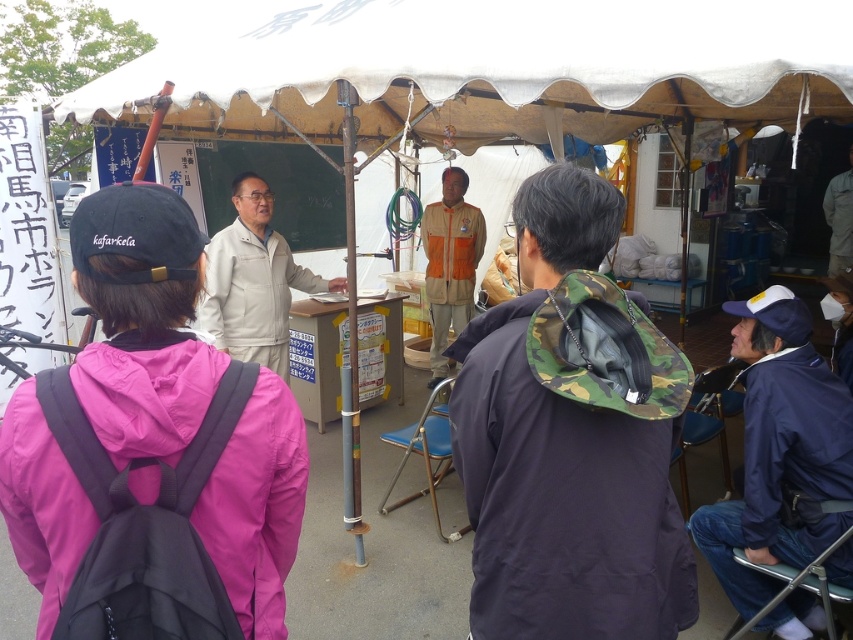
Is white fabric canopy at upper center thinner than camo jacket at center?

No.

Is white fabric canopy at upper center wider than camo jacket at center?

Yes, white fabric canopy at upper center is wider than camo jacket at center.

Where is `white fabric canopy at upper center`? white fabric canopy at upper center is located at coordinates (497, 67).

Where is `white fabric canopy at upper center`? white fabric canopy at upper center is located at coordinates (497, 67).

Is beige fabric jacket at center above orange fabric shirt at center?

Incorrect, beige fabric jacket at center is not positioned above orange fabric shirt at center.

Is beige fabric jacket at center bigger than orange fabric shirt at center?

Actually, beige fabric jacket at center might be smaller than orange fabric shirt at center.

Does point (264, 209) come closer to viewer compared to point (433, 211)?

Yes, point (264, 209) is closer to viewer.

At what (x,y) coordinates should I click in order to perform the action: click on beige fabric jacket at center. Please return your answer as a coordinate pair (x, y). The width and height of the screenshot is (853, 640). Looking at the image, I should click on (253, 282).

Consider the image. Is the position of navy blue jacket at lower right less distant than that of beige fabric jacket at center?

Yes, it is.

Is navy blue jacket at lower right further to camera compared to beige fabric jacket at center?

That is False.

Does point (837, 522) lie in front of point (245, 227)?

That is True.

Identify the location of navy blue jacket at lower right. (780, 452).